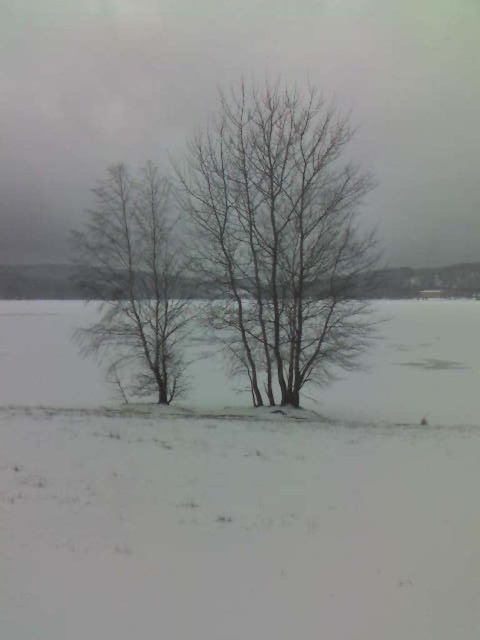
Question: Which point appears closest to the camera in this image?

Choices:
 (A) (189, 509)
 (B) (288, 365)

Answer: (A)

Question: Does bare branches at center have a greater width compared to bare branches at left?

Choices:
 (A) yes
 (B) no

Answer: (B)

Question: Estimate the real-world distances between objects in this image. Which object is farther from the bare branches at center?

Choices:
 (A) bare branches at left
 (B) white powdery snow at center

Answer: (B)

Question: Where is bare branches at center located in relation to bare branches at left in the image?

Choices:
 (A) above
 (B) below

Answer: (A)

Question: Considering the relative positions of white powdery snow at center and bare branches at left in the image provided, where is white powdery snow at center located with respect to bare branches at left?

Choices:
 (A) left
 (B) right

Answer: (B)

Question: Which object is positioned closest to the white powdery snow at center?

Choices:
 (A) bare branches at center
 (B) bare branches at left

Answer: (B)